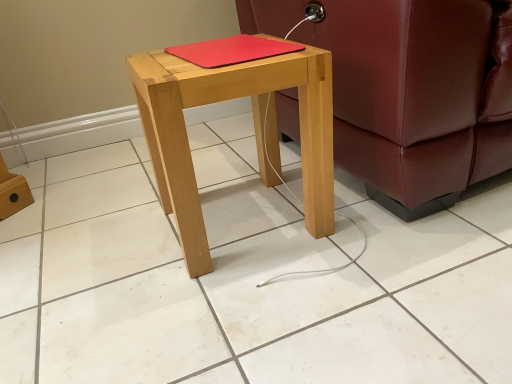
Locate an element on the screen. This screenshot has height=384, width=512. vacant space underneath natural wood stool at center (from a real-world perspective) is located at coordinates (250, 220).